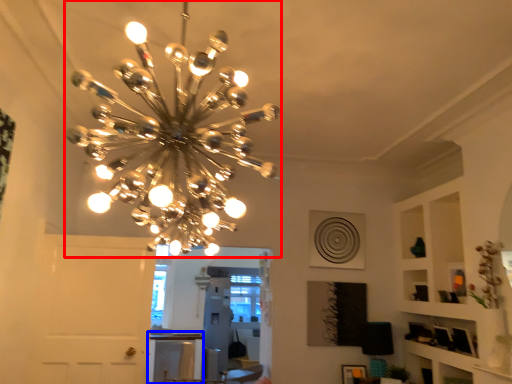
Question: Which object appears closest to the camera in this image, lamp (highlighted by a red box) or table (highlighted by a blue box)?

Choices:
 (A) lamp
 (B) table

Answer: (A)